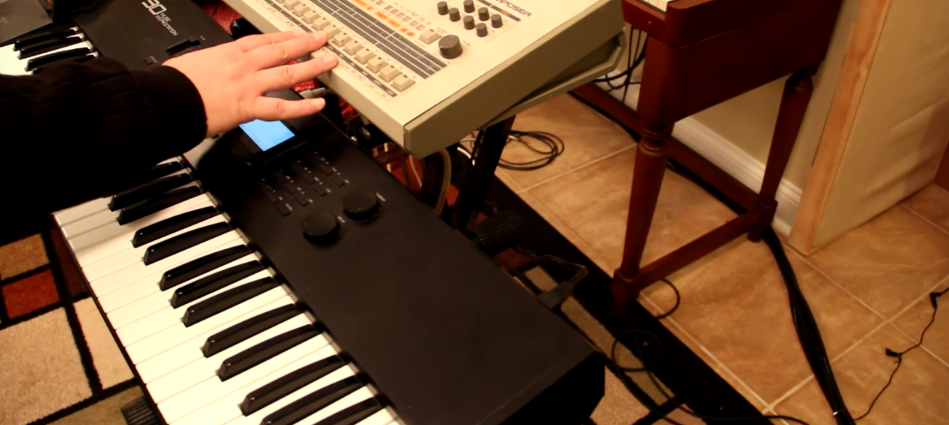
The height and width of the screenshot is (425, 949). I want to click on table leg, so click(650, 204), click(779, 159).